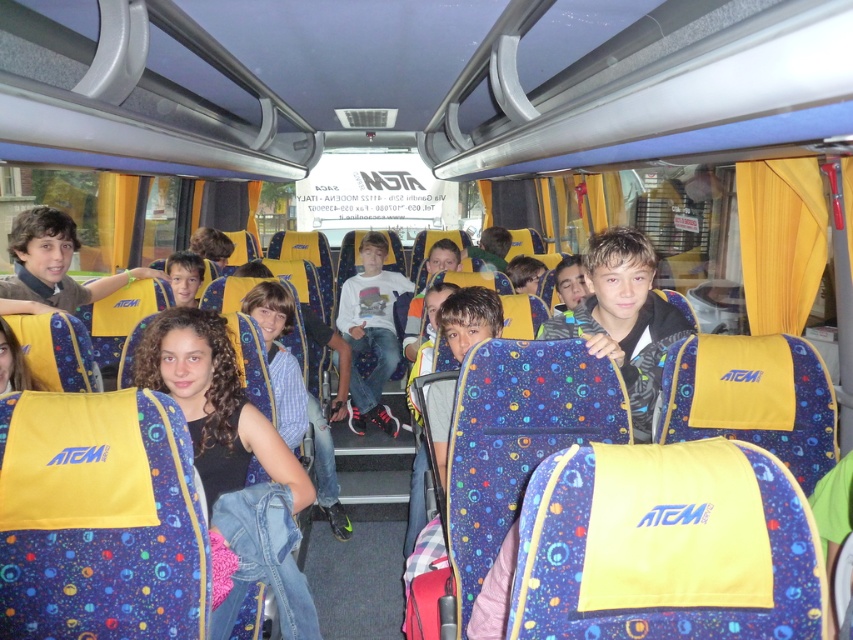
You are a photographer standing in front of the bus. You want to take a photo of the white cotton shirt at center and the blue denim jeans at center. Which clothing item is wider?

The white cotton shirt at center is wider than the blue denim jeans at center.

You are a photographer standing in front of the bus window. You want to take a photo of both the point at coordinates point (x=140, y=344) and point (x=404, y=288) inside the bus. Since you can only focus on one point at a time, which point should you focus on first to ensure the closer one is in focus?

You should focus on point (x=140, y=344) first because it is closer to the camera than point (x=404, y=288), ensuring it will be in focus before adjusting for the farther point.

You are standing on the bus and want to move from the point at coordinates point (x=276, y=449) to the point at coordinates point (x=281, y=333). Which direction should you walk?

You should walk backward because point (x=276, y=449) is in front of point (x=281, y=333), so moving from the front to the back would require walking backward.